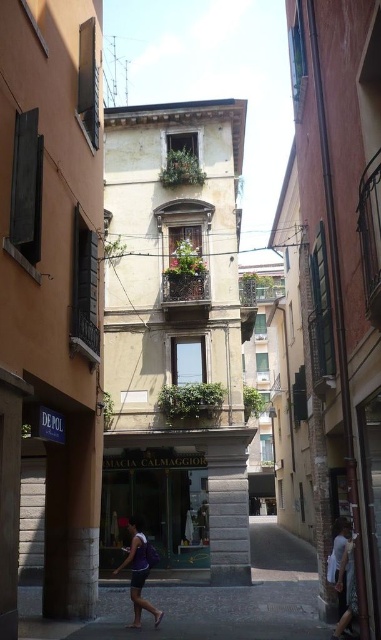
Question: Is white cotton shirt at lower right smaller than purple fabric at center?

Choices:
 (A) no
 (B) yes

Answer: (A)

Question: Which of the following is the closest to the observer?

Choices:
 (A) white cotton shirt at lower right
 (B) purple fabric at center

Answer: (A)

Question: Is white cotton shirt at lower right positioned before purple fabric at center?

Choices:
 (A) yes
 (B) no

Answer: (A)

Question: Is white cotton shirt at lower right to the right of purple fabric at center from the viewer's perspective?

Choices:
 (A) yes
 (B) no

Answer: (A)